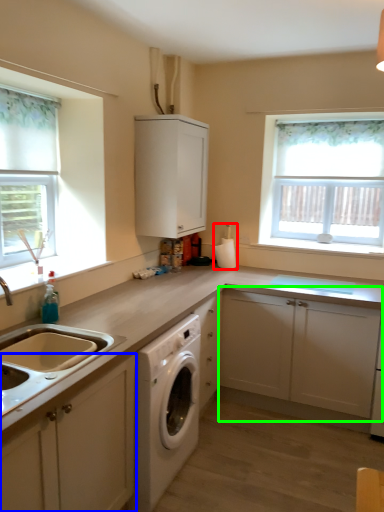
Question: Considering the real-world distances, which object is farthest from appliance (highlighted by a red box)? cabinetry (highlighted by a blue box) or cabinetry (highlighted by a green box)?

Choices:
 (A) cabinetry
 (B) cabinetry

Answer: (A)